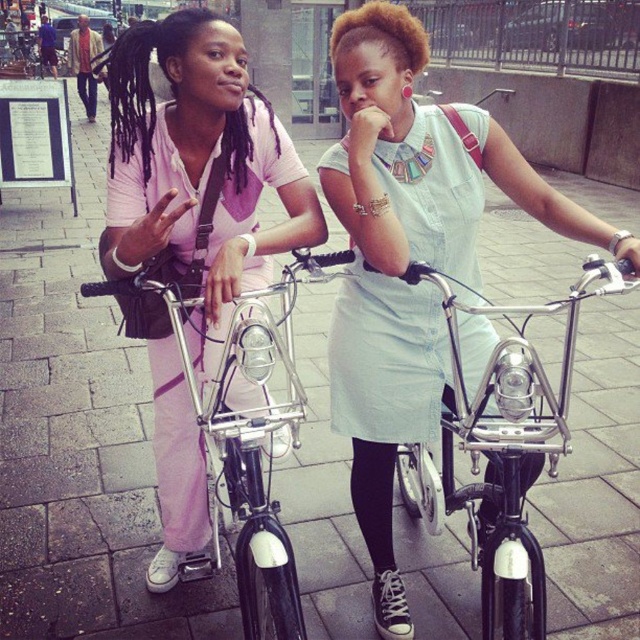
Question: Among these objects, which one is farthest from the camera?

Choices:
 (A) shiny chrome bicycle at center
 (B) light blue dress at center
 (C) brushed metal bicycle at left
 (D) matte pink pants at left

Answer: (B)

Question: Which is farther from the light blue dress at center?

Choices:
 (A) matte pink pants at left
 (B) shiny chrome bicycle at center

Answer: (A)

Question: Is the position of light blue dress at center more distant than that of shiny chrome bicycle at center?

Choices:
 (A) yes
 (B) no

Answer: (A)

Question: Is matte pink pants at left to the right of shiny chrome bicycle at center from the viewer's perspective?

Choices:
 (A) yes
 (B) no

Answer: (B)

Question: Does matte pink pants at left appear over brushed metal bicycle at left?

Choices:
 (A) no
 (B) yes

Answer: (B)

Question: Which of the following is the farthest from the observer?

Choices:
 (A) (205, 326)
 (B) (461, 493)

Answer: (B)